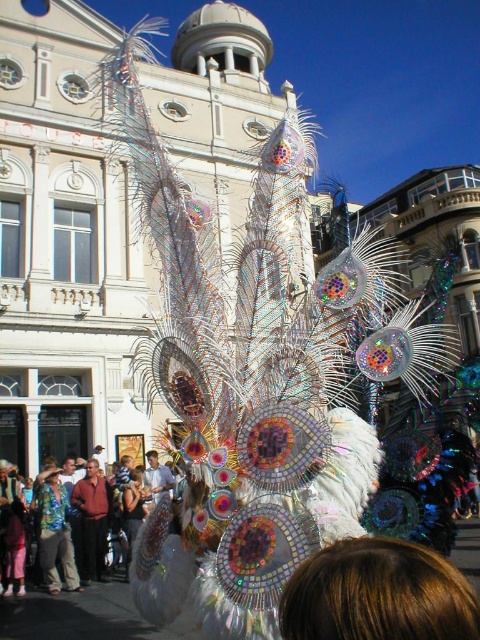
Question: Can you confirm if brown hair at lower center is positioned below red shirt at center?

Choices:
 (A) no
 (B) yes

Answer: (A)

Question: Which point is farther from the camera taking this photo?

Choices:
 (A) (57, 554)
 (B) (46, 472)

Answer: (B)

Question: Which of the following is the closest to the observer?

Choices:
 (A) multicolored sequined costume at center
 (B) brown hair at lower center
 (C) printed fabric shirt at center

Answer: (B)

Question: Does printed fabric shirt at center appear over red shirt at center?

Choices:
 (A) no
 (B) yes

Answer: (B)

Question: Can you confirm if multicolored sequined costume at center is wider than printed fabric shirt at center?

Choices:
 (A) yes
 (B) no

Answer: (A)

Question: Which of the following is the closest to the observer?

Choices:
 (A) brown hair at lower center
 (B) multicolored sequined costume at center
 (C) red shirt at center
 (D) printed fabric shirt at center

Answer: (A)